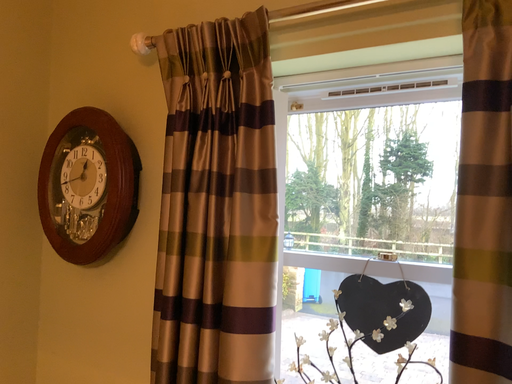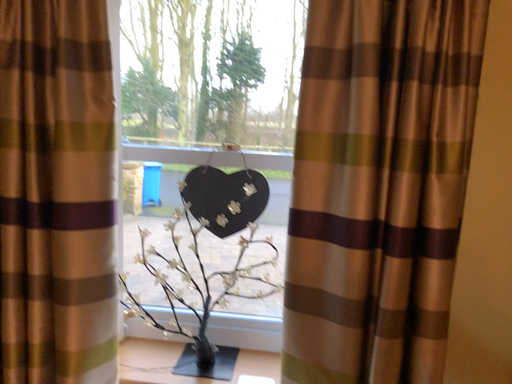
Question: Which way did the camera rotate in the video?

Choices:
 (A) rotated left
 (B) rotated right

Answer: (B)